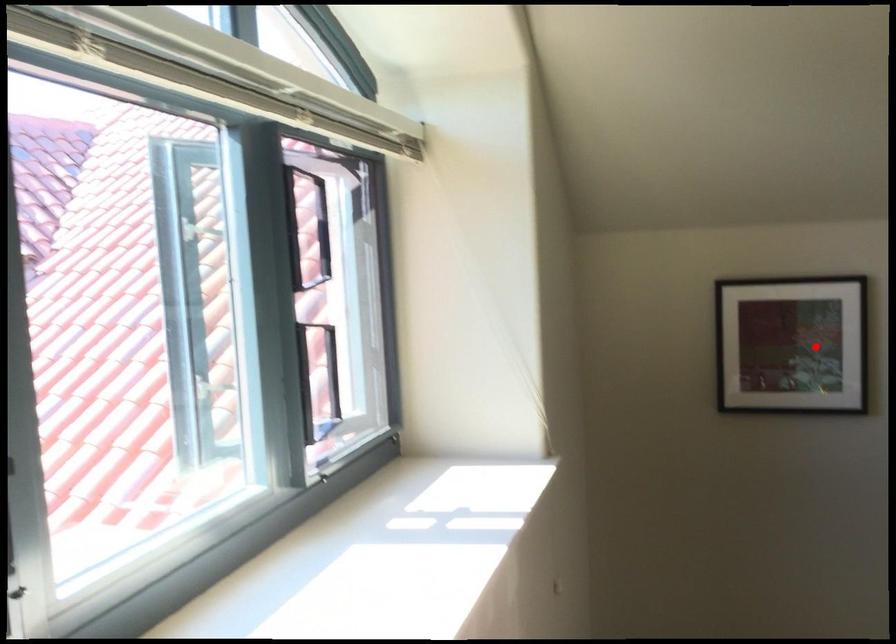
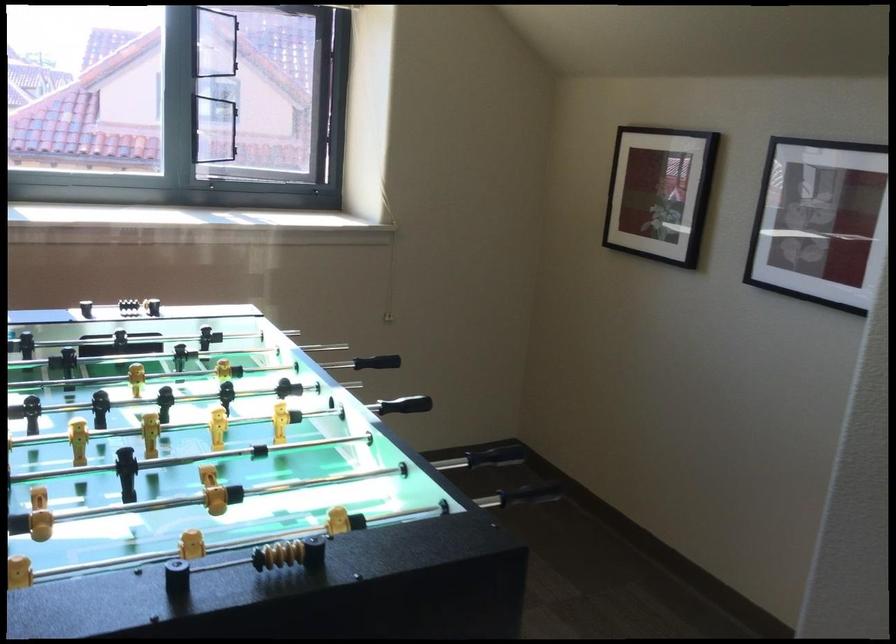
Question: I am providing you with two images of the same scene from different viewpoints. A red point is marked on the first image. Is the red point's position out of view in image 2?

Choices:
 (A) Yes
 (B) No

Answer: (B)